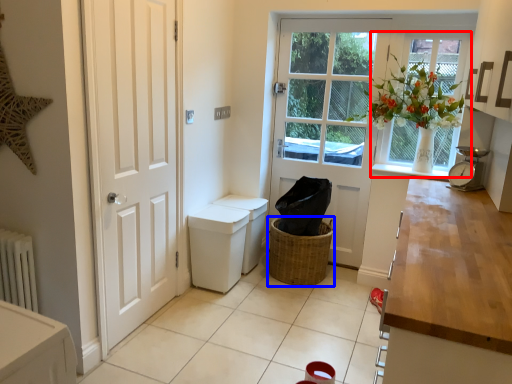
Question: Which point is closer to the camera, window (highlighted by a red box) or basket (highlighted by a blue box)?

Choices:
 (A) window
 (B) basket

Answer: (A)